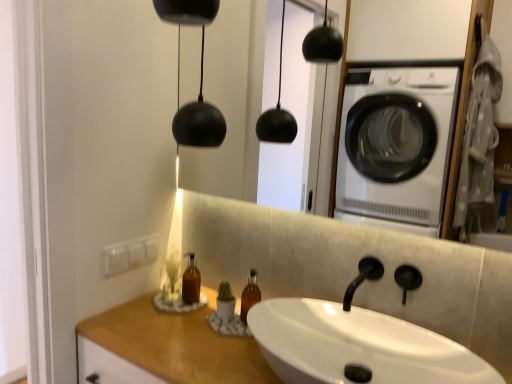
Locate an element on the screen. This screenshot has height=384, width=512. vacant region to the left of translucent amber bottle at center is located at coordinates (129, 314).